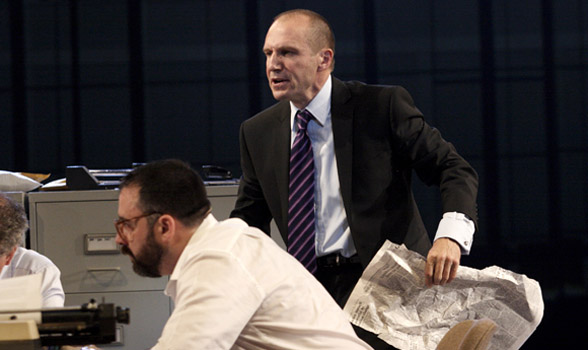
Find the location of a particular element. newspaper is located at coordinates (409, 291).